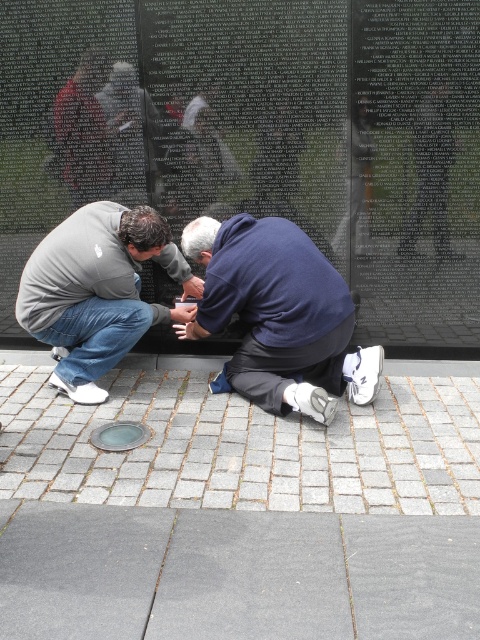
Question: Among these objects, which one is nearest to the camera?

Choices:
 (A) blue fabric at center
 (B) gray brick pavement at lower center
 (C) gray matte hoodie at lower left
 (D) gray concrete pavement at lower center

Answer: (D)

Question: Is gray brick pavement at lower center behind gray matte hoodie at lower left?

Choices:
 (A) yes
 (B) no

Answer: (B)

Question: Based on their relative distances, which object is farther from the gray brick pavement at lower center?

Choices:
 (A) gray concrete pavement at lower center
 (B) blue fabric at center

Answer: (B)

Question: Considering the relative positions of gray concrete pavement at lower center and gray brick pavement at lower center in the image provided, where is gray concrete pavement at lower center located with respect to gray brick pavement at lower center?

Choices:
 (A) right
 (B) left

Answer: (A)

Question: Which of the following is the closest to the observer?

Choices:
 (A) blue fabric at center
 (B) gray brick pavement at lower center
 (C) gray matte hoodie at lower left

Answer: (B)

Question: Can you confirm if blue fabric at center is thinner than gray matte hoodie at lower left?

Choices:
 (A) yes
 (B) no

Answer: (B)